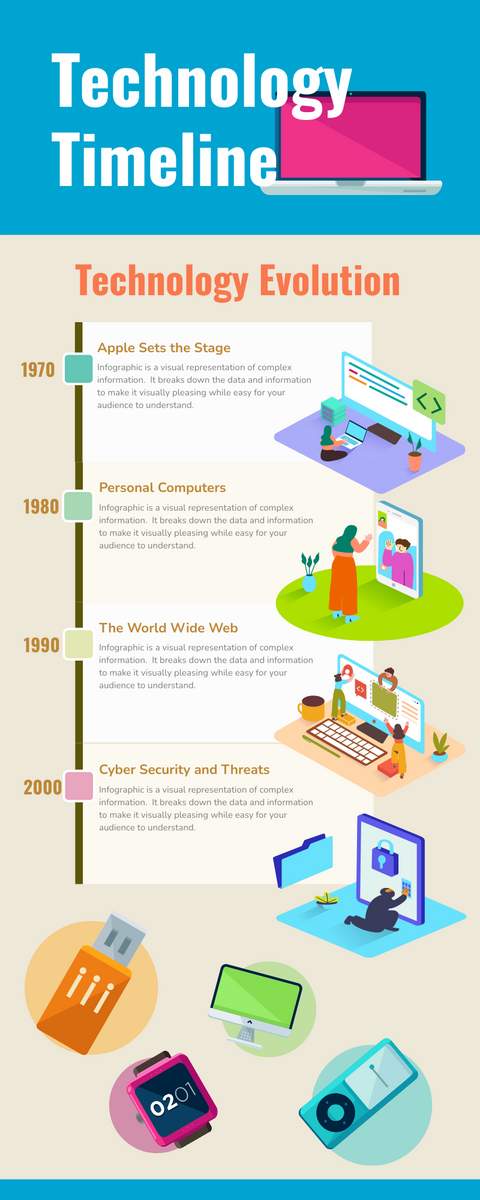
Image resolution: width=480 pixels, height=1200 pixels. In order to click on monitor in this screenshot , I will do `click(242, 990)`.